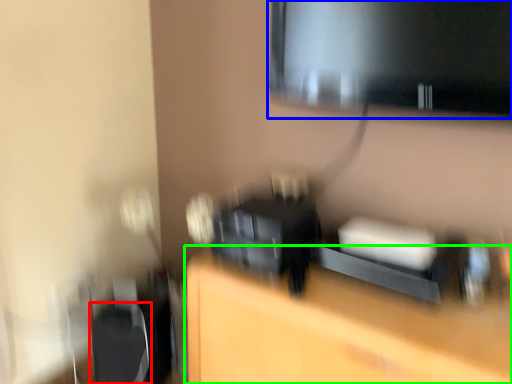
Question: Which object is the closest to the swivel chair (highlighted by a red box)? Choose among these: computer monitor (highlighted by a blue box) or furniture (highlighted by a green box).

Choices:
 (A) computer monitor
 (B) furniture

Answer: (B)